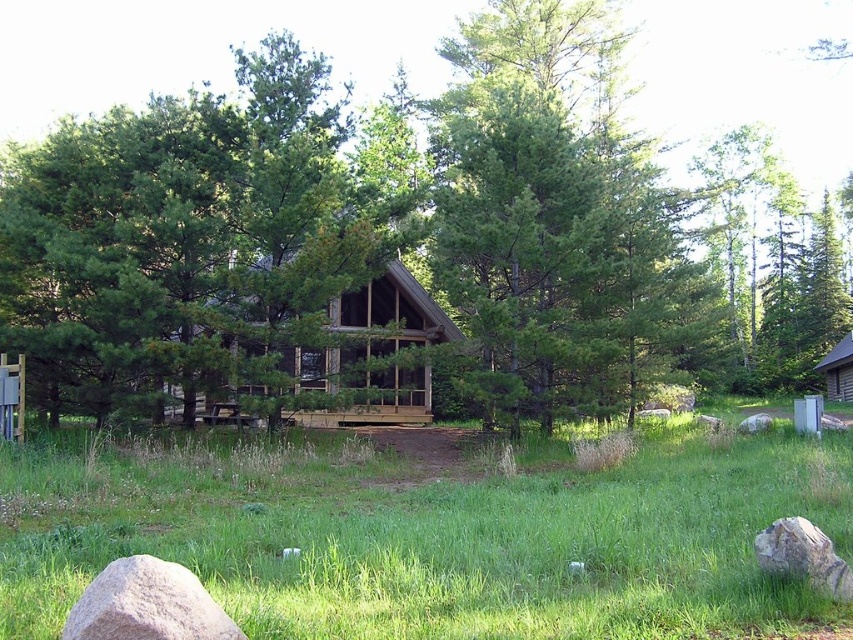
Question: Estimate the real-world distances between objects in this image. Which object is closer to the green grass at center?

Choices:
 (A) gray rough rock at lower right
 (B) wooden cabin at center
 (C) brown log cabin at right
 (D) gray rough rock at lower left

Answer: (D)

Question: Can you confirm if green grass at center is wider than wooden cabin at center?

Choices:
 (A) no
 (B) yes

Answer: (B)

Question: Which of the following is the closest to the observer?

Choices:
 (A) (799, 554)
 (B) (850, 138)

Answer: (A)

Question: Estimate the real-world distances between objects in this image. Which object is farther from the green grass at center?

Choices:
 (A) gray rough rock at lower right
 (B) green wood tree at center
 (C) wooden cabin at center
 (D) gray rough rock at lower left

Answer: (B)

Question: Is wooden cabin at center bigger than brown log cabin at right?

Choices:
 (A) no
 (B) yes

Answer: (B)

Question: Is green wood tree at center positioned in front of gray rough rock at lower left?

Choices:
 (A) yes
 (B) no

Answer: (B)